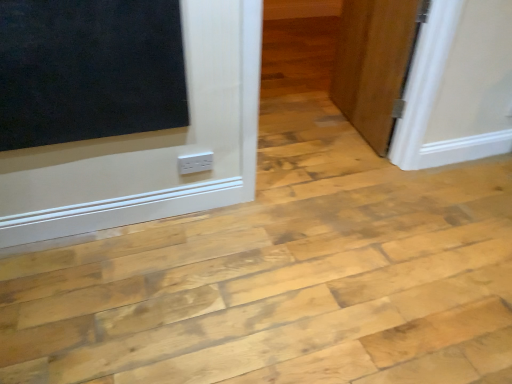
Question: From a real-world perspective, is white plastic electric outlet at lower center on top of wooden door at right?

Choices:
 (A) no
 (B) yes

Answer: (A)

Question: Is white plastic electric outlet at lower center far away from wooden door at right?

Choices:
 (A) no
 (B) yes

Answer: (B)

Question: Can we say white plastic electric outlet at lower center lies outside wooden door at right?

Choices:
 (A) no
 (B) yes

Answer: (B)

Question: Is wooden door at right at the back of white plastic electric outlet at lower center?

Choices:
 (A) no
 (B) yes

Answer: (A)

Question: Does white plastic electric outlet at lower center turn towards wooden door at right?

Choices:
 (A) no
 (B) yes

Answer: (A)

Question: Can you confirm if white plastic electric outlet at lower center is bigger than wooden door at right?

Choices:
 (A) no
 (B) yes

Answer: (A)

Question: Is wooden door at right smaller than white plastic electric outlet at lower center?

Choices:
 (A) no
 (B) yes

Answer: (A)

Question: Does wooden door at right appear on the right side of white plastic electric outlet at lower center?

Choices:
 (A) no
 (B) yes

Answer: (B)

Question: Does wooden door at right touch white plastic electric outlet at lower center?

Choices:
 (A) yes
 (B) no

Answer: (B)

Question: From the image's perspective, is wooden door at right under white plastic electric outlet at lower center?

Choices:
 (A) yes
 (B) no

Answer: (B)

Question: Could white plastic electric outlet at lower center be considered to be inside wooden door at right?

Choices:
 (A) yes
 (B) no

Answer: (B)

Question: Is wooden door at right positioned before white plastic electric outlet at lower center?

Choices:
 (A) yes
 (B) no

Answer: (B)

Question: From the image's perspective, is white plastic electric outlet at lower center above or below wooden door at right?

Choices:
 (A) above
 (B) below

Answer: (B)